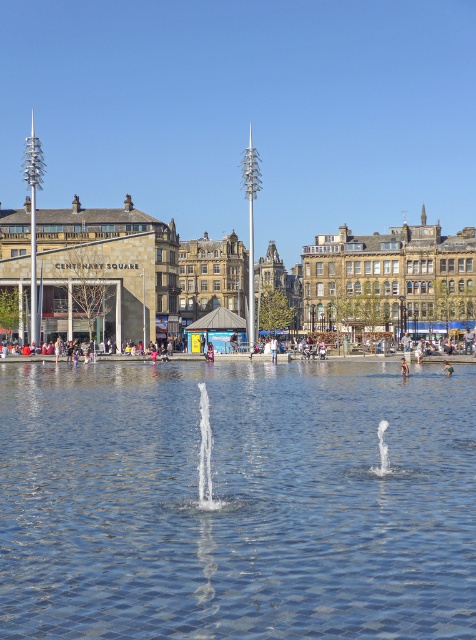
You are a tourist visiting Centenary Square and notice two objects at the center of the scene. Which one is bigger between the brown stone buildings at center and the light blue jeans at center?

The brown stone buildings at center are larger in size than the light blue jeans at center.

You are a tourist visiting Centenary Square and want to take a photo of both the brown stone buildings at center and the light blue jeans at center. Which object should you stand closer to in order to capture both in a single frame?

You should stand closer to the light blue jeans at center because the brown stone buildings at center is much taller, so positioning yourself nearer to the shorter object will help include both in the frame.

You are standing at the center of Centenary Square and see two points marked on the ground. One is at point (404,406) and the other is at point (446,360). Which point is closer to you?

Point (404,406) is in front of point (446,360), so it is closer to you.